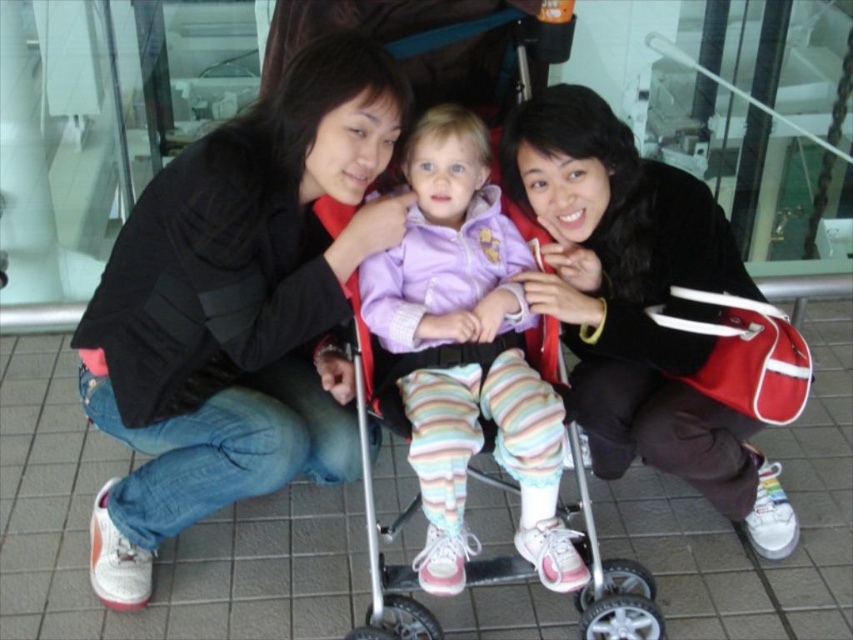
You are a fashion designer observing the scene. You notice the black soft jacket at center and the pastel striped leggings at center. Which clothing item has a bigger size?

The black soft jacket at center has a larger size compared to the pastel striped leggings at center.

You are a photographer trying to capture a candid shot of the two adults in the scene. Since you want to ensure both are in the frame, can you confirm if the matte black jacket at center is positioned to the left or right of the black soft jacket at center?

The matte black jacket at center is positioned to the left of the black soft jacket at center.